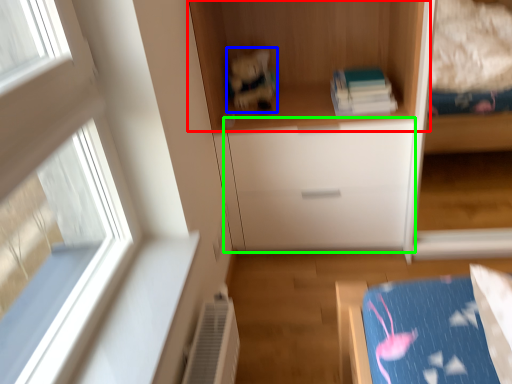
Question: Which object is the farthest from cupboard (highlighted by a red box)? Choose among these: toy (highlighted by a blue box) or drawer (highlighted by a green box).

Choices:
 (A) toy
 (B) drawer

Answer: (B)